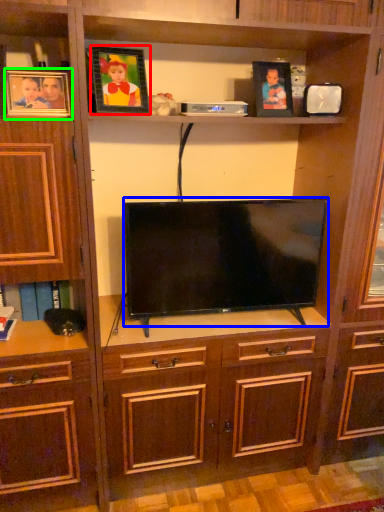
Question: Which object is positioned farthest from picture frame (highlighted by a red box)? Select from television (highlighted by a blue box) and picture frame (highlighted by a green box).

Choices:
 (A) television
 (B) picture frame

Answer: (A)